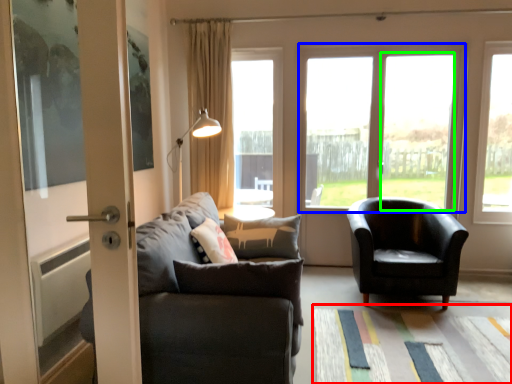
Question: Which object is the closest to the mat (highlighted by a red box)? Choose among these: window (highlighted by a blue box) or window frame (highlighted by a green box).

Choices:
 (A) window
 (B) window frame

Answer: (A)